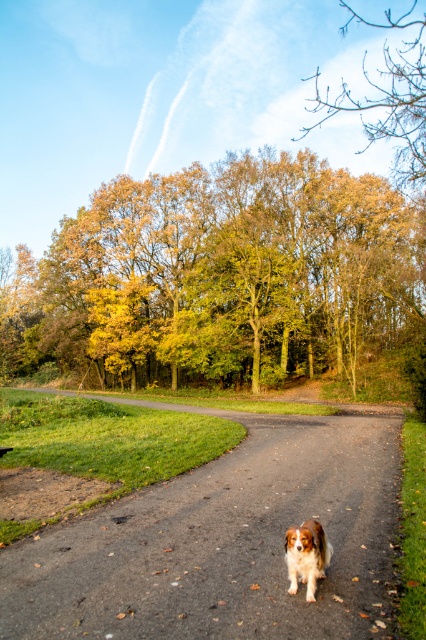
Question: Which is nearer to the brown and white fur dog at center?

Choices:
 (A) yellow-green leaves at upper center
 (B) asphalt road at center

Answer: (B)

Question: Which point is closer to the camera taking this photo?

Choices:
 (A) (353, 317)
 (B) (327, 472)
 (C) (305, 531)

Answer: (C)

Question: Does asphalt road at center appear on the left side of brown leafy tree at upper center?

Choices:
 (A) yes
 (B) no

Answer: (A)

Question: Is yellow-green leaves at upper center to the right of brown leafy tree at upper center from the viewer's perspective?

Choices:
 (A) yes
 (B) no

Answer: (B)

Question: Considering the real-world distances, which object is closest to the asphalt road at center?

Choices:
 (A) yellow-green leaves at upper center
 (B) brown and white fur dog at center

Answer: (B)

Question: Does yellow-green leaves at upper center appear over brown and white fur dog at center?

Choices:
 (A) no
 (B) yes

Answer: (B)